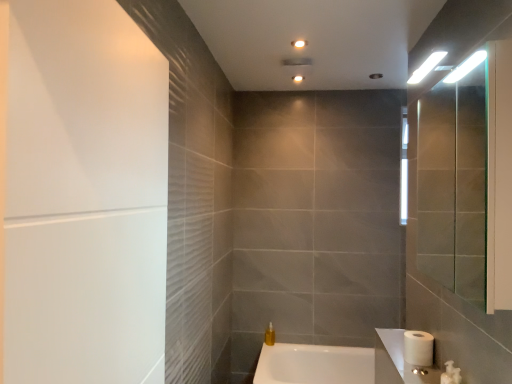
Question: Is translucent yellow liquid at lower center to the left or to the right of white glossy bathtub at lower center in the image?

Choices:
 (A) right
 (B) left

Answer: (B)

Question: In the image, is translucent yellow liquid at lower center positioned in front of or behind white glossy bathtub at lower center?

Choices:
 (A) front
 (B) behind

Answer: (B)

Question: Which object is positioned farthest from the matte white ceiling light at upper center?

Choices:
 (A) white glossy sink at lower right
 (B) white glossy toilet at lower right
 (C) white matte toilet paper at lower right
 (D) white glossy bathtub at lower center
 (E) clear glass mirror at right

Answer: (D)

Question: Which is nearer to the matte white ceiling light at upper center?

Choices:
 (A) white glossy toilet at lower right
 (B) translucent yellow liquid at lower center
 (C) white glossy sink at lower right
 (D) clear glass mirror at right
 (E) white matte toilet paper at lower right

Answer: (D)